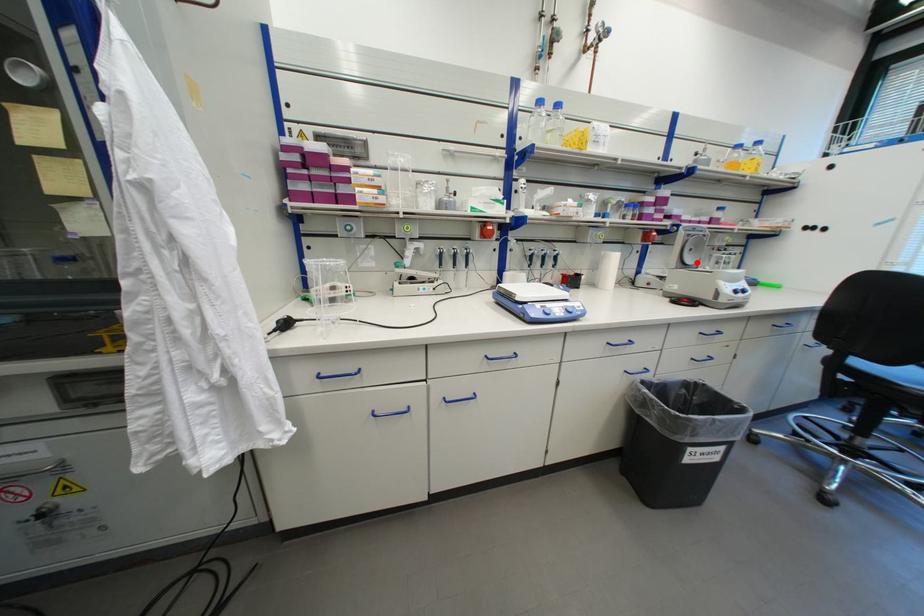
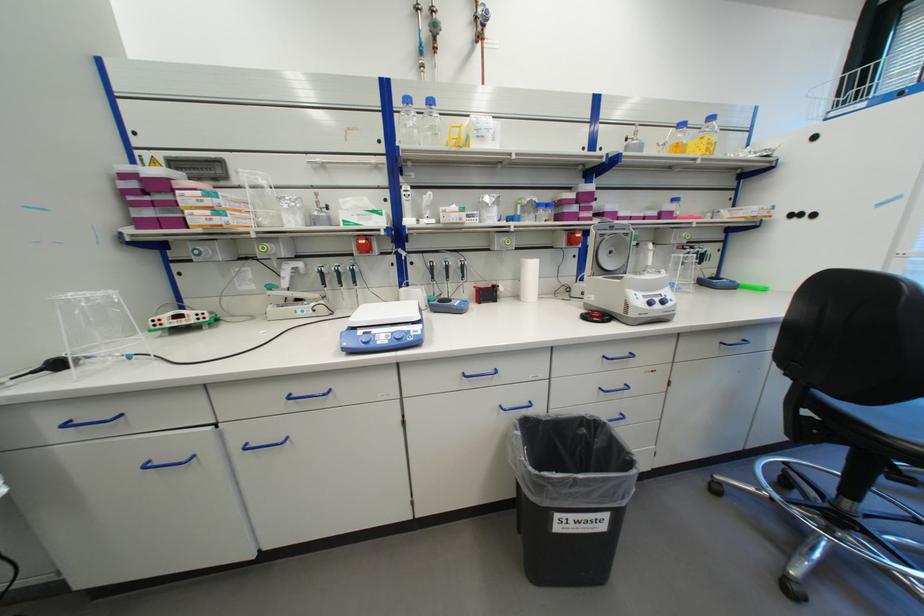
Locate, in the second image, the point that corresponds to the highlighted location in the first image.

(616, 267)